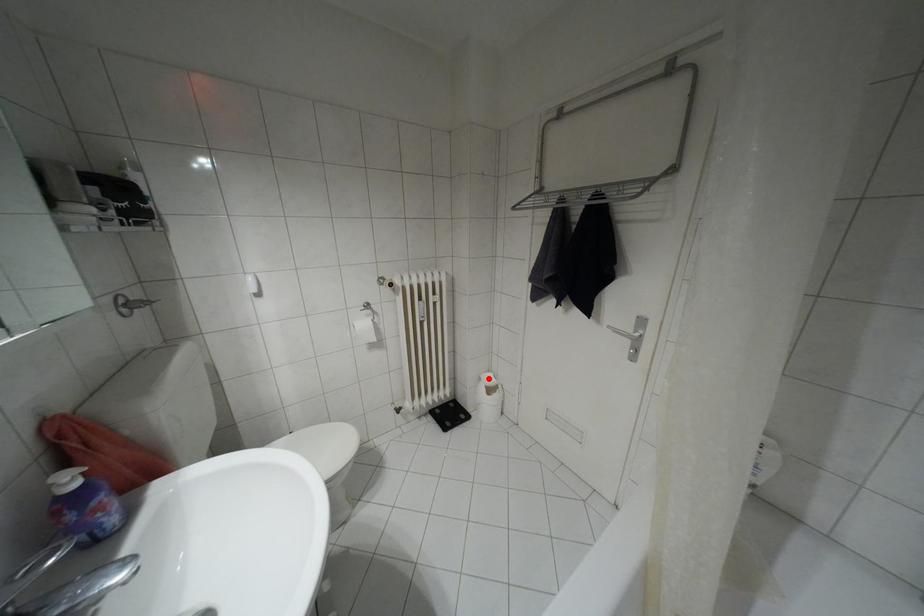
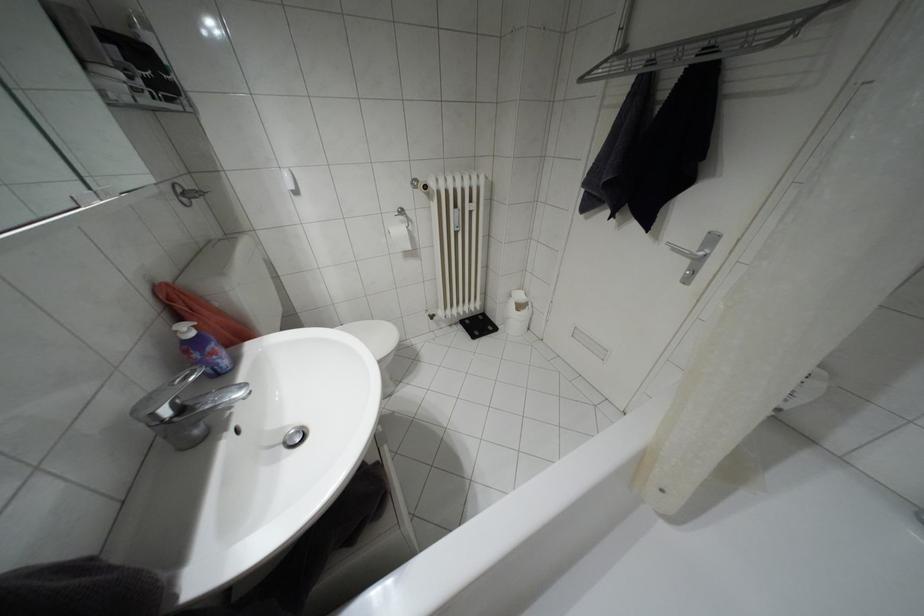
Question: I am providing you with two images of the same scene from different viewpoints. A red point is marked on the first image. Is the red point's position out of view in image 2?

Choices:
 (A) Yes
 (B) No

Answer: (B)